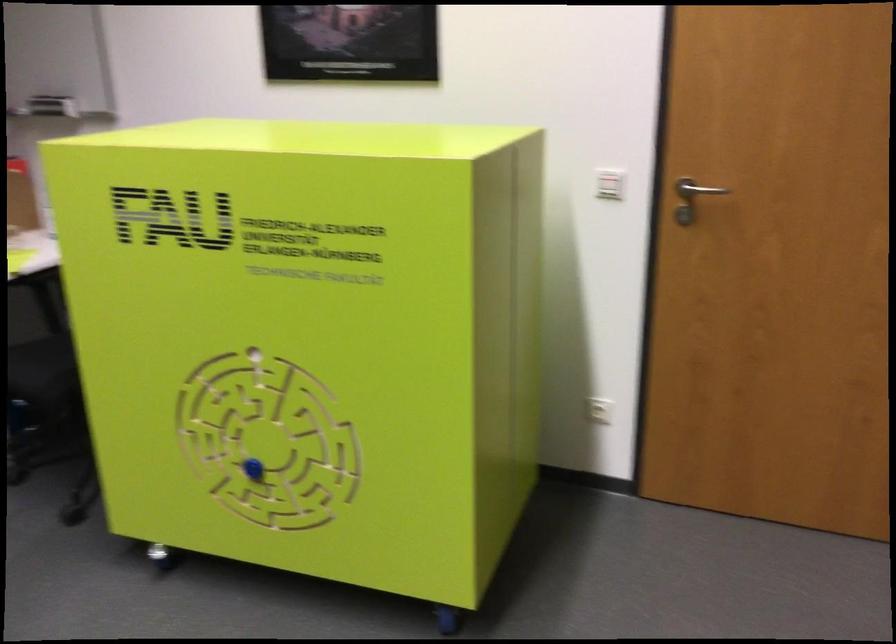
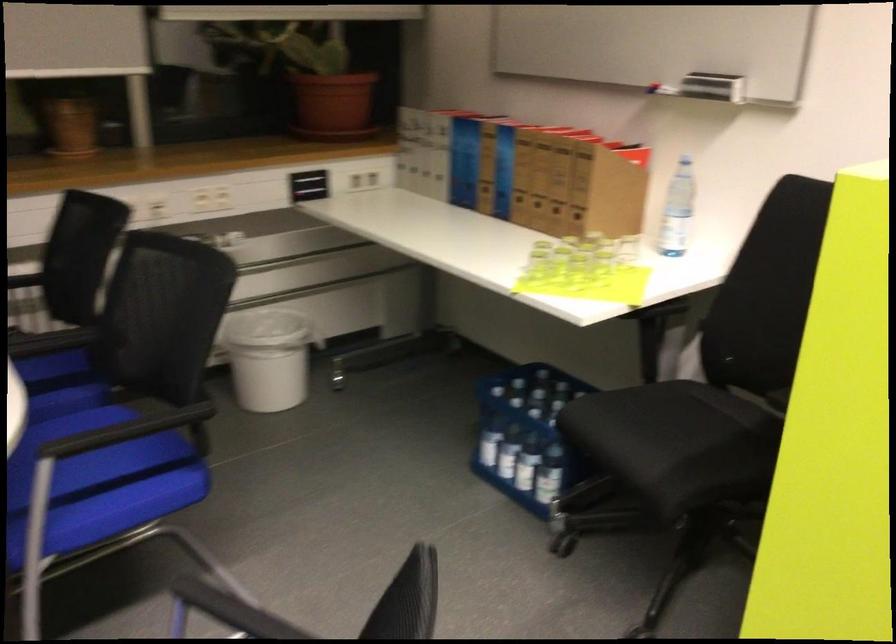
What movement of the cameraman would produce the second image?

The cameraman moved toward left, forward.